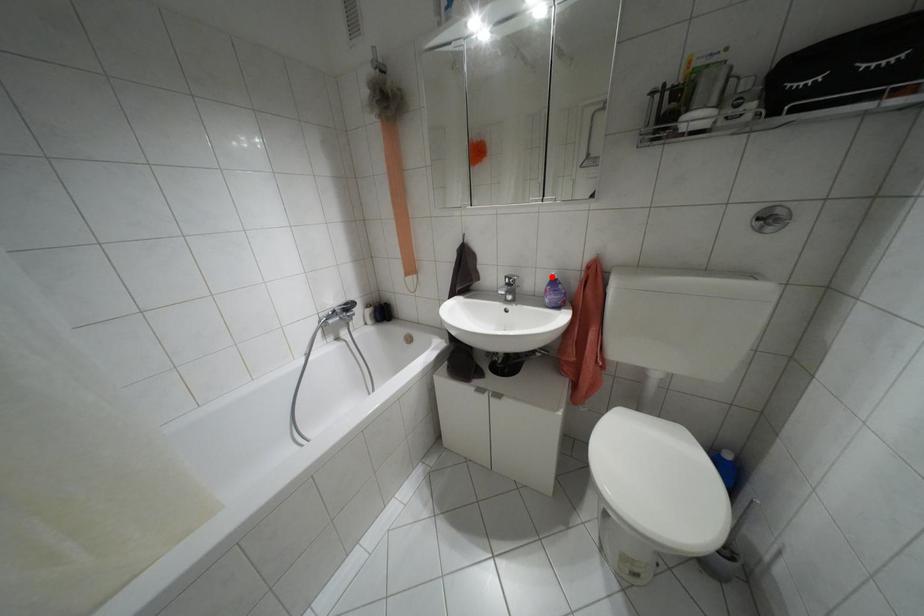
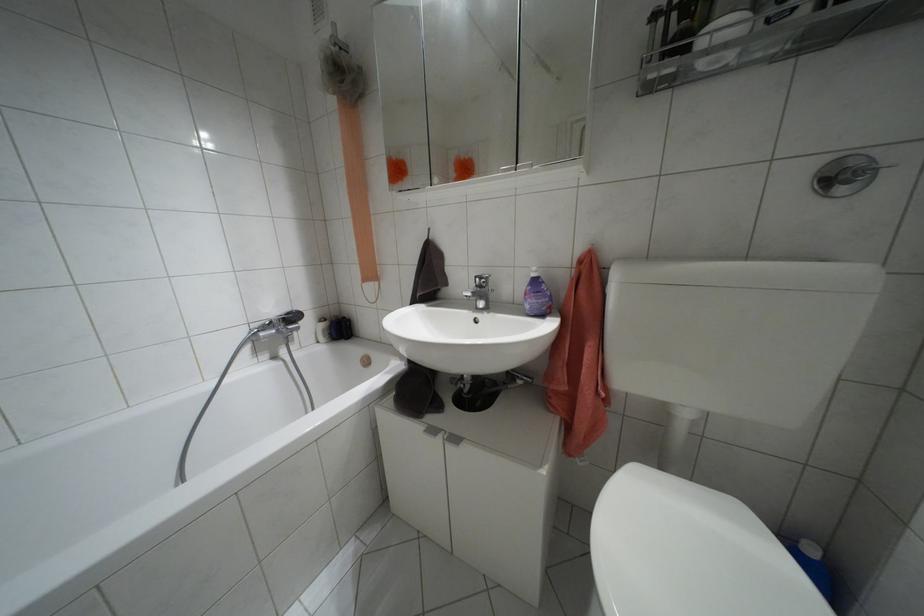
Where in the second image is the point corresponding to the highlighted location from the first image?

(532, 274)